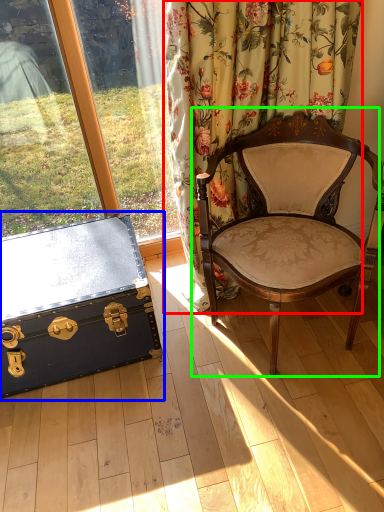
Question: Which is farther away from curtain (highlighted by a red box)? box (highlighted by a blue box) or chair (highlighted by a green box)?

Choices:
 (A) box
 (B) chair

Answer: (A)